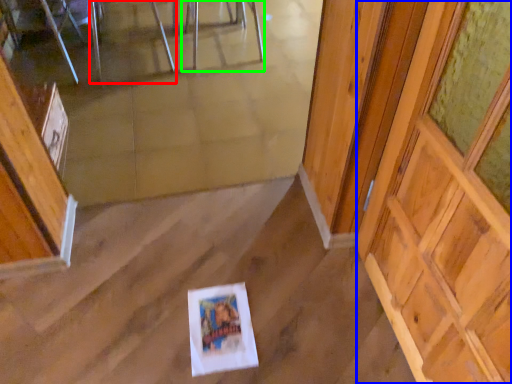
Question: Which object is the closest to the chair (highlighted by a red box)? Choose among these: barn door (highlighted by a blue box) or chair (highlighted by a green box).

Choices:
 (A) barn door
 (B) chair

Answer: (B)